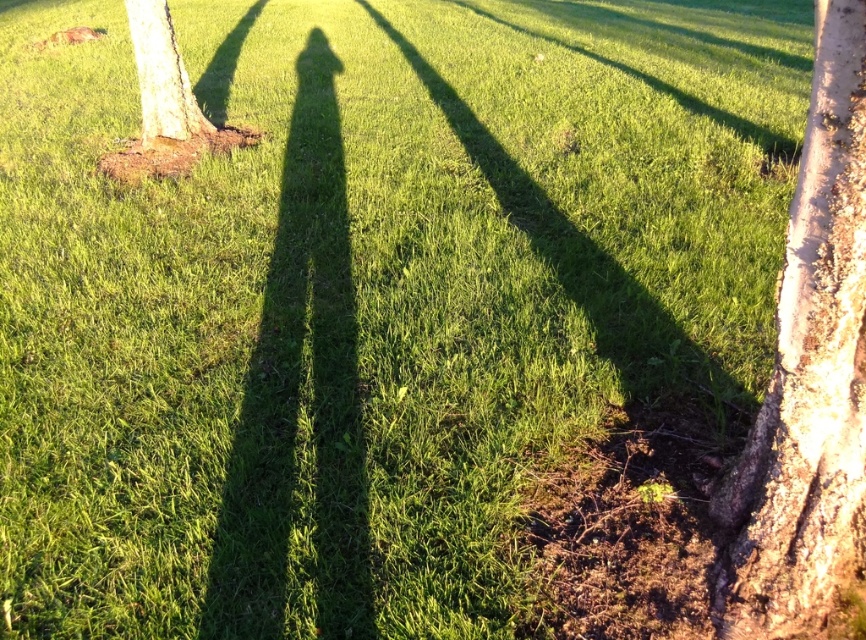
Between bark textured tree trunk at right and smooth bark tree at left, which one has less height?

With less height is smooth bark tree at left.

Which is more to the right, bark textured tree trunk at right or smooth bark tree at left?

Positioned to the right is bark textured tree trunk at right.

Locate an element on the screen. bark textured tree trunk at right is located at coordinates (808, 376).

Locate an element on the screen. The height and width of the screenshot is (640, 866). bark textured tree trunk at right is located at coordinates (808, 376).